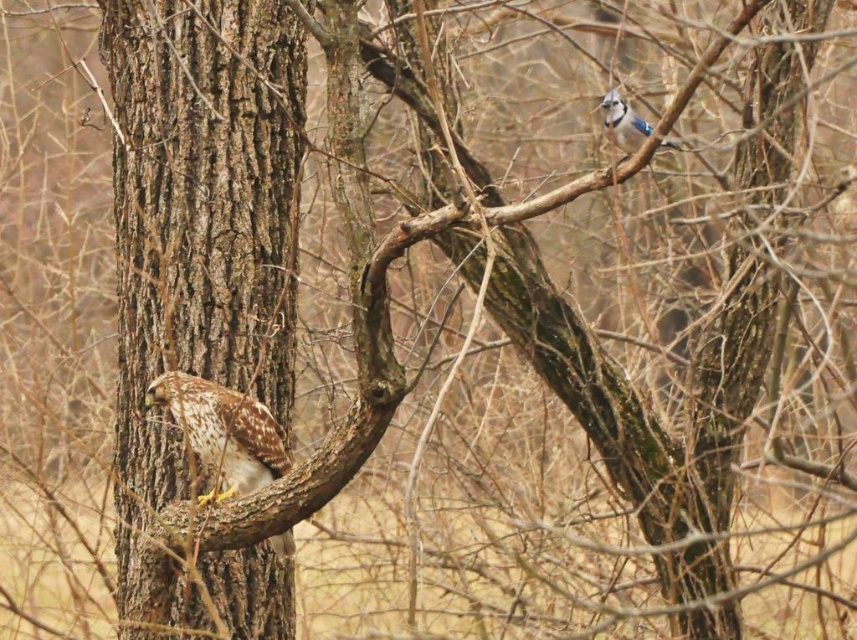
You are a birdwatcher trying to identify the birds in the image. You notice two birds on branches. The first is on the brown rough bark tree trunk at left, and the second is on the blue speckled feathers at upper right. Which bird is perched on a wider branch?

The bird on the brown rough bark tree trunk at left is perched on a wider branch because the brown rough bark tree trunk at left has a greater width than the blue speckled feathers at upper right.

You are an ornithologist studying bird behavior. You notice a point marked at coordinates (223, 432) in the image. Based on the scene description, which bird is this point most likely located on?

The point is on the brown speckled feathers at left, which belong to the larger bird, possibly a hawk, perched on the thick, textured tree trunk. Therefore, the point is most likely located on the larger bird at the left.

You are a birdwatcher observing the scene. You notice a point marked at coordinates (199,220). What object in the scene is located at this point?

The point at coordinates (199,220) indicates the brown rough bark tree trunk at left where the larger bird is perched.